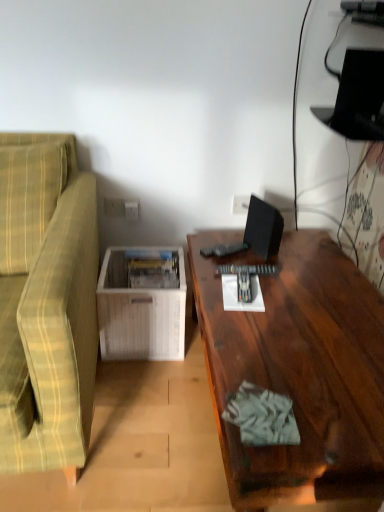
Question: From a real-world perspective, relative to dark wood desk at right, is black matte computer monitor at upper right vertically above or below?

Choices:
 (A) below
 (B) above

Answer: (B)

Question: Is black matte computer monitor at upper right situated inside dark wood desk at right or outside?

Choices:
 (A) outside
 (B) inside

Answer: (A)

Question: Considering the real-world distances, which object is closest to the white wood magazine rack at lower left?

Choices:
 (A) white plastic electric outlet at center, which is the 2th electric outlet from front to back
 (B) dark wood desk at right
 (C) green plaid fabric couch at left
 (D) white plastic electric outlet at center, acting as the 2th electric outlet starting from the back
 (E) black matte computer monitor at upper right

Answer: (C)

Question: Considering the real-world distances, which object is closest to the white plastic electric outlet at center, placed as the first electric outlet when sorted from right to left?

Choices:
 (A) white plastic electric outlet at center, acting as the 2th electric outlet starting from the back
 (B) dark wood desk at right
 (C) white wood magazine rack at lower left
 (D) black matte computer monitor at upper right
 (E) green plaid fabric couch at left

Answer: (D)